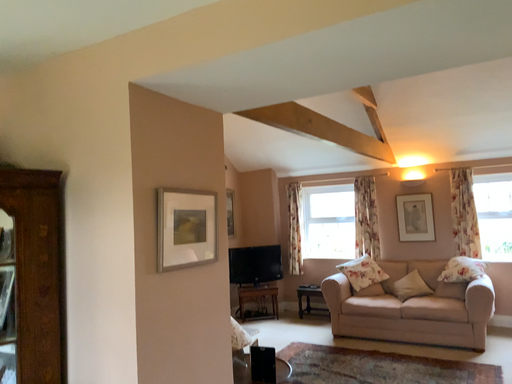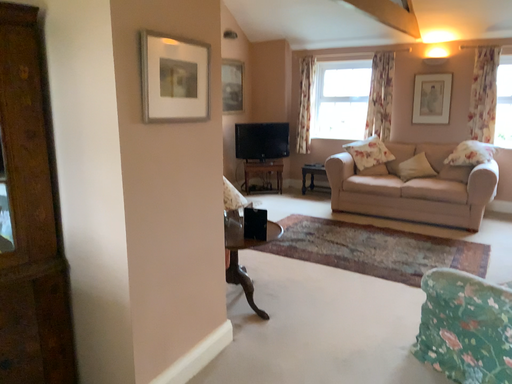
Question: How did the camera likely rotate when shooting the video?

Choices:
 (A) rotated upward
 (B) rotated downward

Answer: (B)